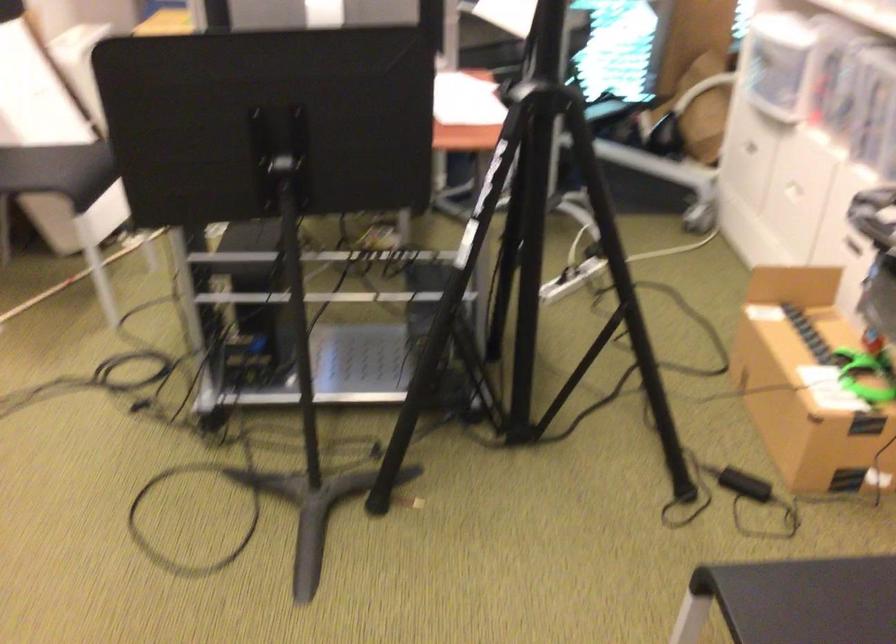
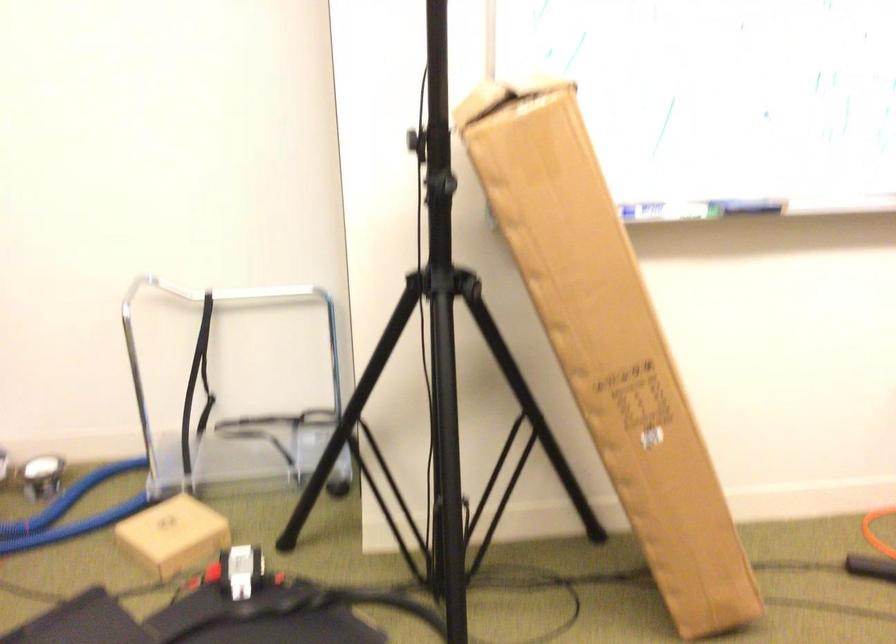
Question: The images are taken continuously from a first-person perspective. In which direction is your viewpoint rotating?

Choices:
 (A) Left
 (B) Right
 (C) Up
 (D) Down

Answer: (A)